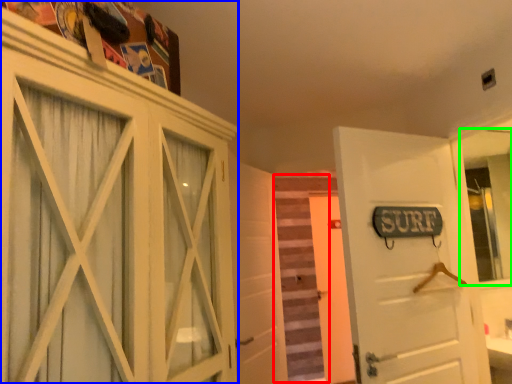
Question: Based on their relative distances, which object is farther from stair (highlighted by a red box)? Choose from cabinetry (highlighted by a blue box) and mirror (highlighted by a green box).

Choices:
 (A) cabinetry
 (B) mirror

Answer: (A)